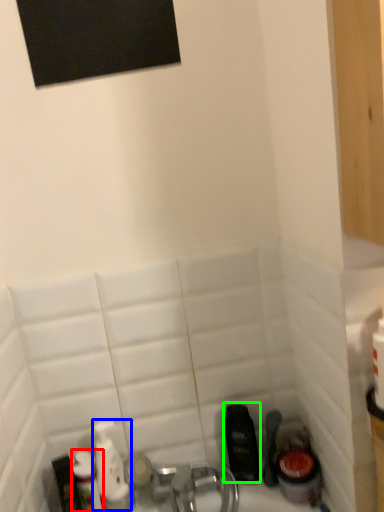
Question: Considering the real-world distances, which object is closest to toiletry (highlighted by a red box)? mouthwash (highlighted by a blue box) or mouthwash (highlighted by a green box).

Choices:
 (A) mouthwash
 (B) mouthwash

Answer: (A)